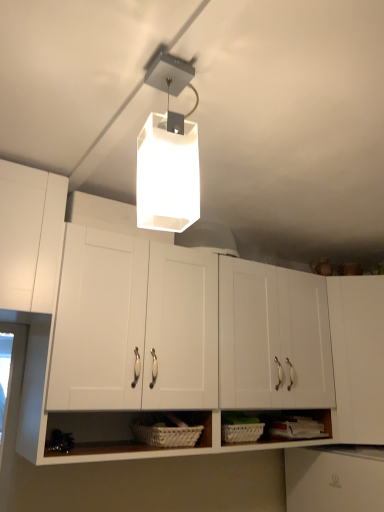
What is the approximate width of white matte rectangular light fixture at upper center?

The width of white matte rectangular light fixture at upper center is 4.79 inches.

What do you see at coordinates (168, 156) in the screenshot? This screenshot has height=512, width=384. I see `white matte rectangular light fixture at upper center` at bounding box center [168, 156].

Describe the element at coordinates (358, 356) in the screenshot. I see `white matte cabinet at right, marked as the 1th cabinetry in a right-to-left arrangement` at that location.

You are a GUI agent. You are given a task and a screenshot of the screen. Output one action in this format:
    pyautogui.click(x=<x>, y=<y>)
    Task: Click on the white matte cabinet at right, positioned as the 2th cabinetry in left-to-right order
    
    Given the screenshot: What is the action you would take?
    pyautogui.click(x=358, y=356)

Describe the element at coordinates (166, 434) in the screenshot. This screenshot has width=384, height=512. I see `white woven basket at lower center` at that location.

Identify the location of white matte rectangular light fixture at upper center. This screenshot has width=384, height=512. (168, 156).

Is white woven basket at lower center closer to the viewer compared to white matte cabinet at center, the second cabinetry viewed from the right?

No, white woven basket at lower center is behind white matte cabinet at center, the second cabinetry viewed from the right.

How distant is white woven basket at lower center from white matte cabinet at center, placed as the 1th cabinetry when sorted from left to right?

white woven basket at lower center and white matte cabinet at center, placed as the 1th cabinetry when sorted from left to right, are 17.36 inches apart from each other.

Is white woven basket at lower center completely or partially outside of white matte cabinet at center, placed as the 1th cabinetry when sorted from left to right?

No, most part of white woven basket at lower center lies within white matte cabinet at center, placed as the 1th cabinetry when sorted from left to right.

Considering the relative sizes of white woven basket at lower center and white matte cabinet at center, the second cabinetry viewed from the right, in the image provided, is white woven basket at lower center shorter than white matte cabinet at center, the second cabinetry viewed from the right,?

Correct, white woven basket at lower center is not as tall as white matte cabinet at center, the second cabinetry viewed from the right.

Would you say white matte rectangular light fixture at upper center is a long distance from white woven basket at lower center?

Actually, white matte rectangular light fixture at upper center and white woven basket at lower center are a little close together.

Is white matte rectangular light fixture at upper center aimed at white woven basket at lower center?

No, white matte rectangular light fixture at upper center is not facing towards white woven basket at lower center.

Between white woven basket at lower center and white matte cabinet at right, positioned as the 2th cabinetry in left-to-right order, which one has larger width?

white matte cabinet at right, positioned as the 2th cabinetry in left-to-right order, is wider.

From the image's perspective, would you say white woven basket at lower center is shown under white matte cabinet at right, marked as the 1th cabinetry in a right-to-left arrangement?

Yes, from the image's perspective, white woven basket at lower center is beneath white matte cabinet at right, marked as the 1th cabinetry in a right-to-left arrangement.

Is white woven basket at lower center beside white matte cabinet at right, positioned as the 2th cabinetry in left-to-right order?

No, white woven basket at lower center is not with white matte cabinet at right, positioned as the 2th cabinetry in left-to-right order.

Is white matte rectangular light fixture at upper center positioned far away from white matte cabinet at right, positioned as the 2th cabinetry in left-to-right order?

Yes, white matte rectangular light fixture at upper center is far from white matte cabinet at right, positioned as the 2th cabinetry in left-to-right order.

Who is smaller, white matte rectangular light fixture at upper center or white matte cabinet at right, positioned as the 2th cabinetry in left-to-right order?

white matte rectangular light fixture at upper center.

Find the location of `lamp that appears above the white matte cabinet at right, marked as the 1th cabinetry in a right-to-left arrangement (from a real-world perspective)`. lamp that appears above the white matte cabinet at right, marked as the 1th cabinetry in a right-to-left arrangement (from a real-world perspective) is located at coordinates (168, 156).

How different are the orientations of white matte rectangular light fixture at upper center and white matte cabinet at right, marked as the 1th cabinetry in a right-to-left arrangement, in degrees?

The angle between the facing direction of white matte rectangular light fixture at upper center and the facing direction of white matte cabinet at right, marked as the 1th cabinetry in a right-to-left arrangement, is 34.2 degrees.

Considering the sizes of white matte cabinet at center, the second cabinetry viewed from the right, and white woven basket at lower center in the image, is white matte cabinet at center, the second cabinetry viewed from the right, taller or shorter than white woven basket at lower center?

In the image, white matte cabinet at center, the second cabinetry viewed from the right, appears to be taller than white woven basket at lower center.

Is white matte cabinet at center, the second cabinetry viewed from the right, in contact with white woven basket at lower center?

No, white matte cabinet at center, the second cabinetry viewed from the right, is not in contact with white woven basket at lower center.

Considering the sizes of objects white matte cabinet at center, the second cabinetry viewed from the right, and white woven basket at lower center in the image provided, who is bigger, white matte cabinet at center, the second cabinetry viewed from the right, or white woven basket at lower center?

With larger size is white matte cabinet at center, the second cabinetry viewed from the right.

This screenshot has width=384, height=512. I want to click on lamp above the white woven basket at lower center (from the image's perspective), so (x=168, y=156).

Does white woven basket at lower center appear on the right side of white matte rectangular light fixture at upper center?

No, white woven basket at lower center is not to the right of white matte rectangular light fixture at upper center.

From a real-world perspective, is white woven basket at lower center physically above white matte rectangular light fixture at upper center?

No, from a real-world perspective, white woven basket at lower center is not above white matte rectangular light fixture at upper center.

From a real-world perspective, does white matte cabinet at right, positioned as the 2th cabinetry in left-to-right order, sit lower than white woven basket at lower center?

Incorrect, from a real-world perspective, white matte cabinet at right, positioned as the 2th cabinetry in left-to-right order, is higher than white woven basket at lower center.

From the picture: Is white matte cabinet at right, marked as the 1th cabinetry in a right-to-left arrangement, inside the boundaries of white woven basket at lower center, or outside?

The correct answer is: outside.

From the image's perspective, would you say white matte cabinet at right, positioned as the 2th cabinetry in left-to-right order, is positioned over white woven basket at lower center?

Yes, from the image's perspective, white matte cabinet at right, positioned as the 2th cabinetry in left-to-right order, is over white woven basket at lower center.

Identify the location of basket on the left side of white matte cabinet at center, placed as the 1th cabinetry when sorted from left to right. The height and width of the screenshot is (512, 384). (166, 434).

The height and width of the screenshot is (512, 384). I want to click on lamp that appears above the white woven basket at lower center (from the image's perspective), so click(168, 156).

Based on their spatial positions, is white matte cabinet at center, the second cabinetry viewed from the right, or white matte cabinet at right, positioned as the 2th cabinetry in left-to-right order, closer to white woven basket at lower center?

white matte cabinet at center, the second cabinetry viewed from the right.

Based on their spatial positions, is white woven basket at lower center or white matte cabinet at center, the second cabinetry viewed from the right, further from white matte cabinet at right, marked as the 1th cabinetry in a right-to-left arrangement?

white woven basket at lower center lies further to white matte cabinet at right, marked as the 1th cabinetry in a right-to-left arrangement, than the other object.

Based on their spatial positions, is white matte rectangular light fixture at upper center or white woven basket at lower center further from white matte cabinet at center, the second cabinetry viewed from the right?

white matte rectangular light fixture at upper center is positioned further to the anchor white matte cabinet at center, the second cabinetry viewed from the right.

Which object lies further to the anchor point white matte rectangular light fixture at upper center, white woven basket at lower center or white matte cabinet at right, marked as the 1th cabinetry in a right-to-left arrangement?

Based on the image, white matte cabinet at right, marked as the 1th cabinetry in a right-to-left arrangement, appears to be further to white matte rectangular light fixture at upper center.

From the image, which object appears to be nearer to white matte rectangular light fixture at upper center, white matte cabinet at right, positioned as the 2th cabinetry in left-to-right order, or white matte cabinet at center, the second cabinetry viewed from the right?

Among the two, white matte cabinet at center, the second cabinetry viewed from the right, is located nearer to white matte rectangular light fixture at upper center.

Considering their positions, is white matte rectangular light fixture at upper center positioned further to white matte cabinet at right, positioned as the 2th cabinetry in left-to-right order, than white woven basket at lower center?

The object further to white matte cabinet at right, positioned as the 2th cabinetry in left-to-right order, is white matte rectangular light fixture at upper center.

Which object lies nearer to the anchor point white matte cabinet at center, the second cabinetry viewed from the right, white woven basket at lower center or white matte cabinet at right, marked as the 1th cabinetry in a right-to-left arrangement?

Based on the image, white matte cabinet at right, marked as the 1th cabinetry in a right-to-left arrangement, appears to be nearer to white matte cabinet at center, the second cabinetry viewed from the right.

Which object lies nearer to the anchor point white matte rectangular light fixture at upper center, white woven basket at lower center or white matte cabinet at center, placed as the 1th cabinetry when sorted from left to right?

white matte cabinet at center, placed as the 1th cabinetry when sorted from left to right.

Where is `cabinetry situated between white matte rectangular light fixture at upper center and white matte cabinet at right, marked as the 1th cabinetry in a right-to-left arrangement, from left to right`? The image size is (384, 512). cabinetry situated between white matte rectangular light fixture at upper center and white matte cabinet at right, marked as the 1th cabinetry in a right-to-left arrangement, from left to right is located at coordinates (175, 324).

You are a GUI agent. You are given a task and a screenshot of the screen. Output one action in this format:
    pyautogui.click(x=<x>, y=<y>)
    Task: Click on the lamp located between white woven basket at lower center and white matte cabinet at right, positioned as the 2th cabinetry in left-to-right order, in the left-right direction
    
    Given the screenshot: What is the action you would take?
    pyautogui.click(x=168, y=156)

Identify the location of cabinetry located between white woven basket at lower center and white matte cabinet at right, marked as the 1th cabinetry in a right-to-left arrangement, in the left-right direction. (175, 324).